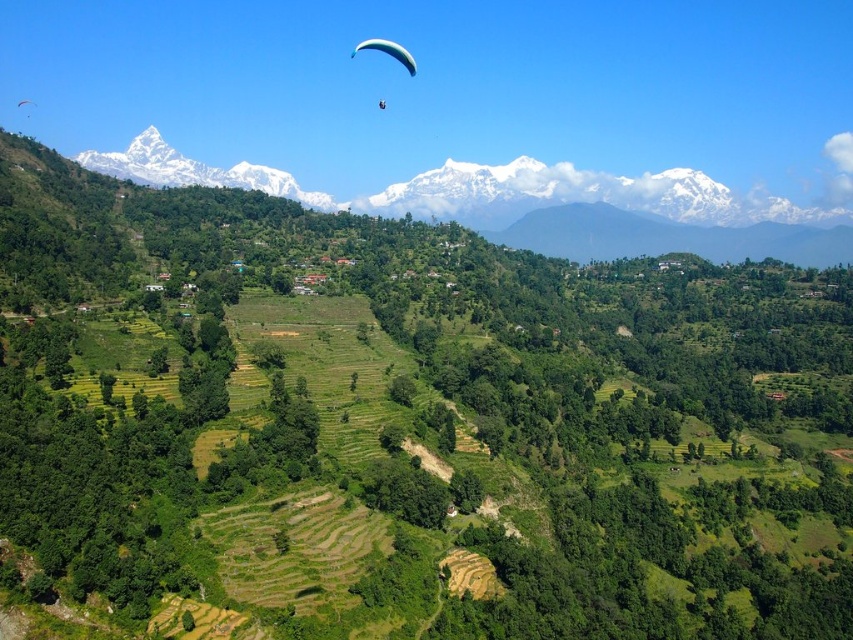
Who is lower down, white snow-covered mountain at upper left or blue fabric parachute at upper center?

Positioned lower is white snow-covered mountain at upper left.

Which is in front, point (84, 154) or point (386, 44)?

Point (386, 44) is in front.

This screenshot has height=640, width=853. Find the location of `white snow-covered mountain at upper left`. white snow-covered mountain at upper left is located at coordinates (195, 172).

Where is `white snow-covered mountain at upper left`? white snow-covered mountain at upper left is located at coordinates (195, 172).